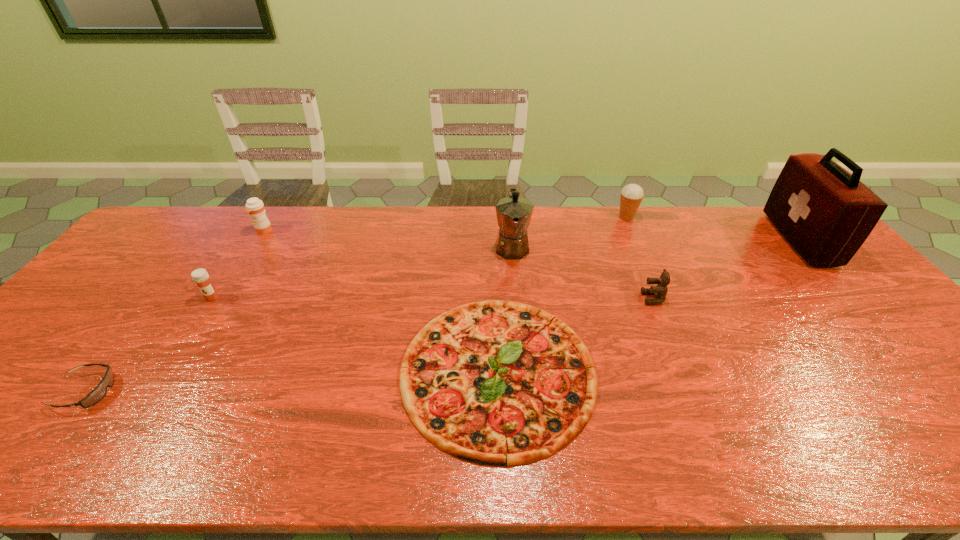
You are a GUI agent. You are given a task and a screenshot of the screen. Output one action in this format:
    pyautogui.click(x=<x>, y=<y>)
    Task: Click on the free space between the coffeepot and the taller medicine
    
    Given the screenshot: What is the action you would take?
    pyautogui.click(x=388, y=239)

Identify the location of vacant region between the second tallest object and the rightmost object. The height and width of the screenshot is (540, 960). (656, 243).

Locate an element on the screen. The height and width of the screenshot is (540, 960). free space between the second tallest object and the teddy bear is located at coordinates (583, 272).

Identify the location of free point between the coffeepot and the shorter medicine. (362, 272).

Image resolution: width=960 pixels, height=540 pixels. Identify the location of vacant space that's between the rightmost object and the teddy bear. (727, 269).

Select which object is the closest to the pizza. Please provide its 2D coordinates. Your answer should be formatted as a tuple, i.e. [(x, y)], where the tuple contains the x and y coordinates of a point satisfying the conditions above.

[(514, 213)]

Find the location of a particular element. Image resolution: width=960 pixels, height=540 pixels. object that is the sixth nearest to the tallest object is located at coordinates (200, 276).

What are the coordinates of `vacant space that satisfies the following two spatial constraints: 1. on the back side of the taller medicine; 2. on the left side of the icecream` in the screenshot? It's located at (272, 218).

Where is `free point that satisfies the following two spatial constraints: 1. on the front side of the pizza; 2. on the left side of the taller medicine`? The height and width of the screenshot is (540, 960). free point that satisfies the following two spatial constraints: 1. on the front side of the pizza; 2. on the left side of the taller medicine is located at coordinates (178, 371).